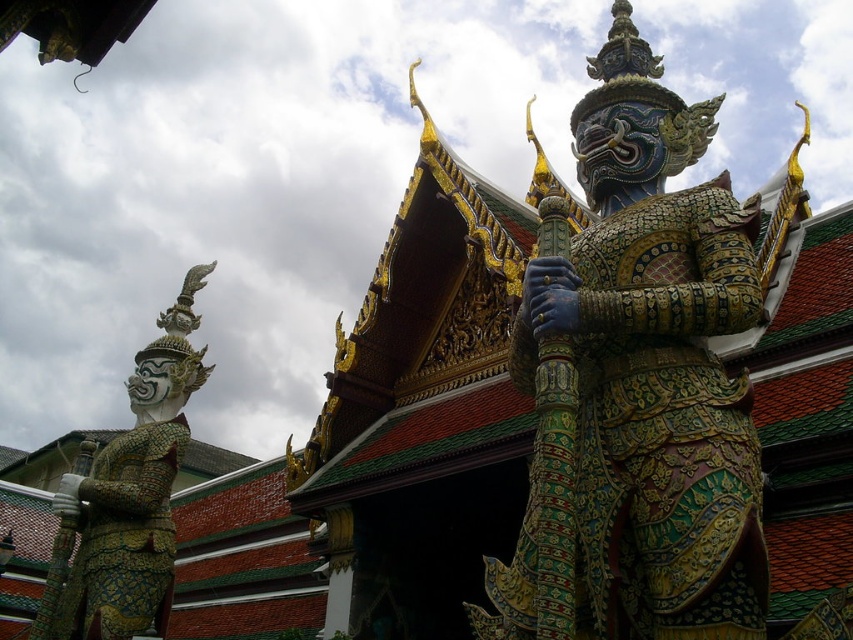
Question: Considering the relative positions of multicolored ornate statue at center and gold textured armor at left in the image provided, where is multicolored ornate statue at center located with respect to gold textured armor at left?

Choices:
 (A) above
 (B) below

Answer: (A)

Question: Which object is closer to the camera taking this photo?

Choices:
 (A) multicolored ornate statue at center
 (B) gold textured armor at left

Answer: (A)

Question: Does multicolored ornate statue at center have a smaller size compared to gold textured armor at left?

Choices:
 (A) no
 (B) yes

Answer: (B)

Question: Is multicolored ornate statue at center to the right of gold textured armor at left from the viewer's perspective?

Choices:
 (A) no
 (B) yes

Answer: (B)

Question: Among these objects, which one is farthest from the camera?

Choices:
 (A) multicolored ornate statue at center
 (B) gold textured armor at left

Answer: (B)

Question: Which point is farther from the camera taking this photo?

Choices:
 (A) (136, 467)
 (B) (590, 336)

Answer: (A)